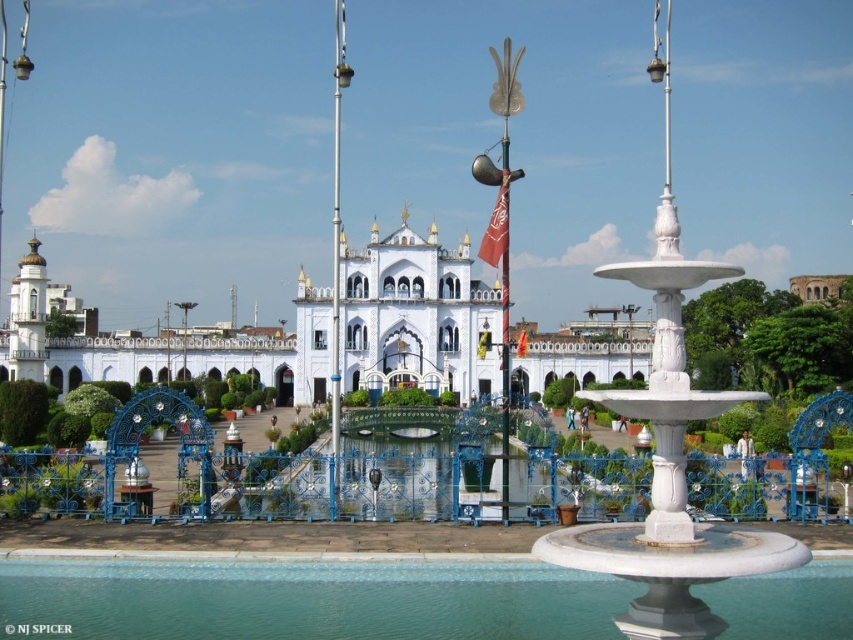
What do you see at coordinates (306, 600) in the screenshot? This screenshot has height=640, width=853. I see `clear glass pool at center` at bounding box center [306, 600].

Does clear glass pool at center have a greater height compared to white marble palace at center?

In fact, clear glass pool at center may be shorter than white marble palace at center.

Where is `clear glass pool at center`? Image resolution: width=853 pixels, height=640 pixels. clear glass pool at center is located at coordinates (306, 600).

Image resolution: width=853 pixels, height=640 pixels. I want to click on clear glass pool at center, so click(x=306, y=600).

Can you confirm if clear glass pool at center is taller than white marble fountain at center?

No, clear glass pool at center is not taller than white marble fountain at center.

Is clear glass pool at center closer to camera compared to white marble fountain at center?

No, it is behind white marble fountain at center.

You are a GUI agent. You are given a task and a screenshot of the screen. Output one action in this format:
    pyautogui.click(x=<x>, y=<y>)
    Task: Click on the clear glass pool at center
    
    Given the screenshot: What is the action you would take?
    pyautogui.click(x=306, y=600)

Which is in front, point (209, 362) or point (631, 624)?

Positioned in front is point (631, 624).

What do you see at coordinates (416, 316) in the screenshot?
I see `white marble palace at center` at bounding box center [416, 316].

Where is `white marble palace at center`? This screenshot has width=853, height=640. white marble palace at center is located at coordinates (416, 316).